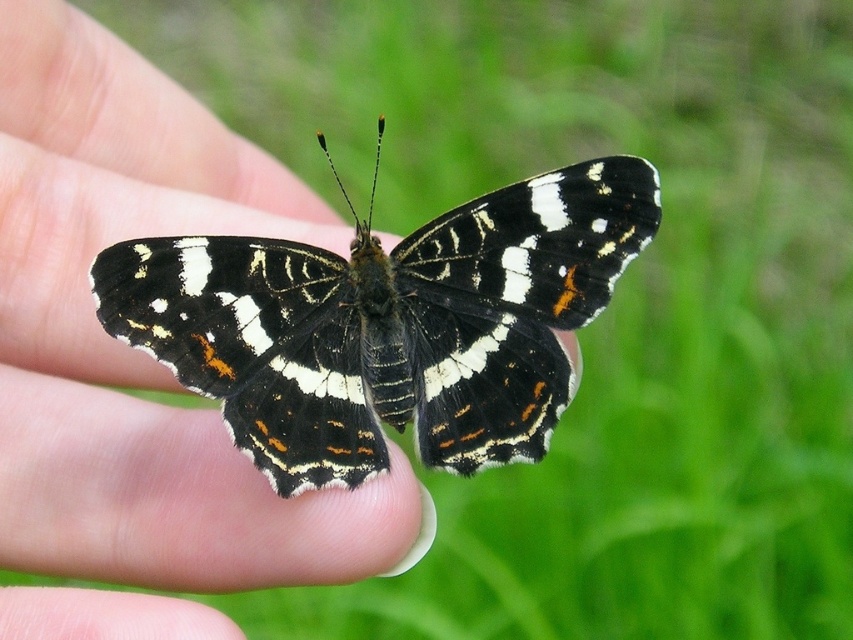
Question: Can you confirm if smooth skin at center is positioned below black glossy butterfly at center?

Choices:
 (A) yes
 (B) no

Answer: (B)

Question: Does smooth skin at center have a larger size compared to black glossy butterfly at center?

Choices:
 (A) yes
 (B) no

Answer: (A)

Question: Considering the relative positions of smooth skin at center and black glossy butterfly at center in the image provided, where is smooth skin at center located with respect to black glossy butterfly at center?

Choices:
 (A) below
 (B) above

Answer: (B)

Question: Among these objects, which one is farthest from the camera?

Choices:
 (A) smooth skin at center
 (B) black glossy butterfly at center

Answer: (B)